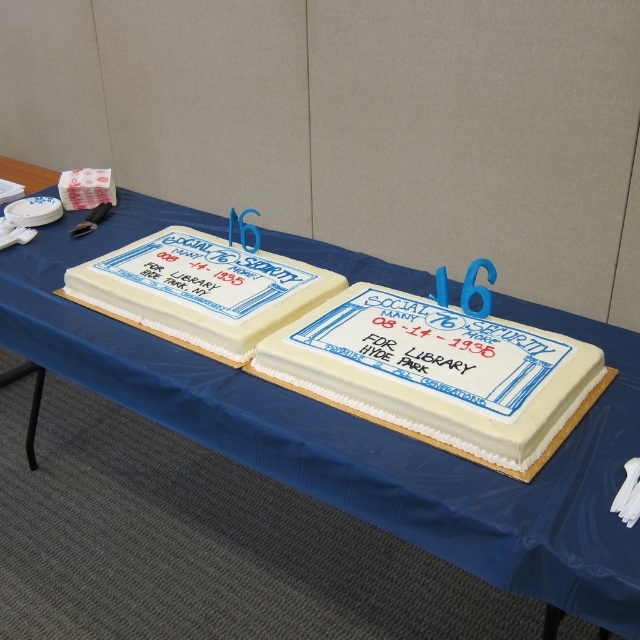
Question: Does white frosted cake at center appear on the left side of white fondant cake at left?

Choices:
 (A) no
 (B) yes

Answer: (A)

Question: Does white frosted cake at center come in front of white fondant cake at left?

Choices:
 (A) yes
 (B) no

Answer: (A)

Question: Which point is closer to the camera?

Choices:
 (A) white frosted cake at center
 (B) white fondant cake at left

Answer: (A)

Question: Can you confirm if white frosted cake at center is bigger than white fondant cake at left?

Choices:
 (A) yes
 (B) no

Answer: (B)

Question: Which of the following is the farthest from the observer?

Choices:
 (A) (276, 358)
 (B) (196, 291)

Answer: (B)